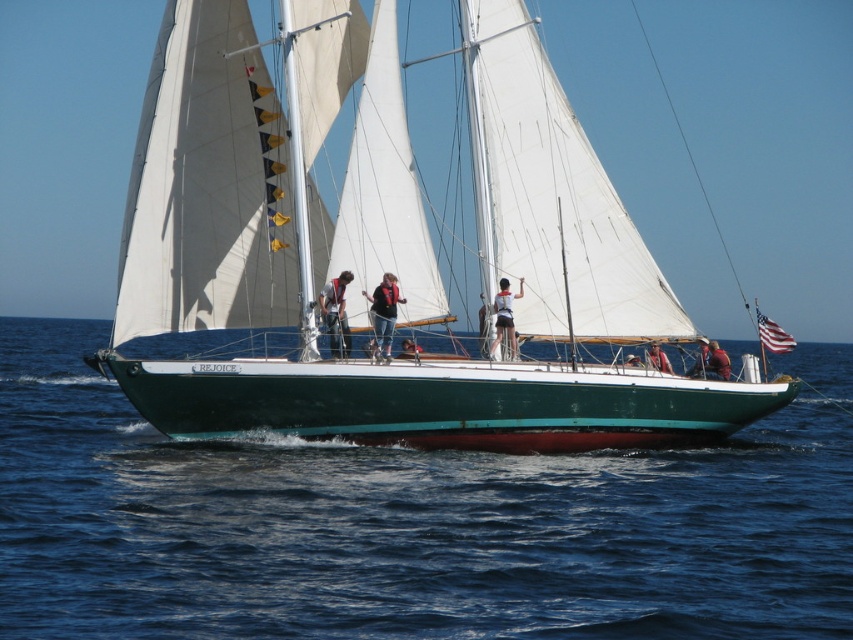
Question: Is matte gray pants at center wider than white matte shorts at center?

Choices:
 (A) yes
 (B) no

Answer: (B)

Question: Estimate the real-world distances between objects in this image. Which object is farther from the matte white sail at center?

Choices:
 (A) matte gray pants at center
 (B) blue water at center
 (C) matte black jacket at center

Answer: (B)

Question: From the image, what is the correct spatial relationship of matte white sail at center in relation to tan leather jacket at center?

Choices:
 (A) above
 (B) below

Answer: (A)

Question: Does matte white sail at center have a lesser width compared to matte gray pants at center?

Choices:
 (A) no
 (B) yes

Answer: (B)

Question: Considering the real-world distances, which object is farthest from the white matte shorts at center?

Choices:
 (A) blue water at center
 (B) matte gray pants at center
 (C) tan leather jacket at center
 (D) matte white sail at center

Answer: (A)

Question: Which object appears closest to the camera in this image?

Choices:
 (A) white matte shorts at center
 (B) blue water at center
 (C) matte gray pants at center

Answer: (B)